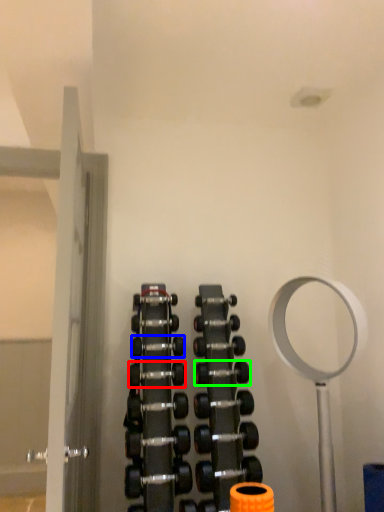
Question: Which is farther away from dumbbell (highlighted by a red box)? dumbbell (highlighted by a blue box) or dumbbell (highlighted by a green box)?

Choices:
 (A) dumbbell
 (B) dumbbell

Answer: (B)